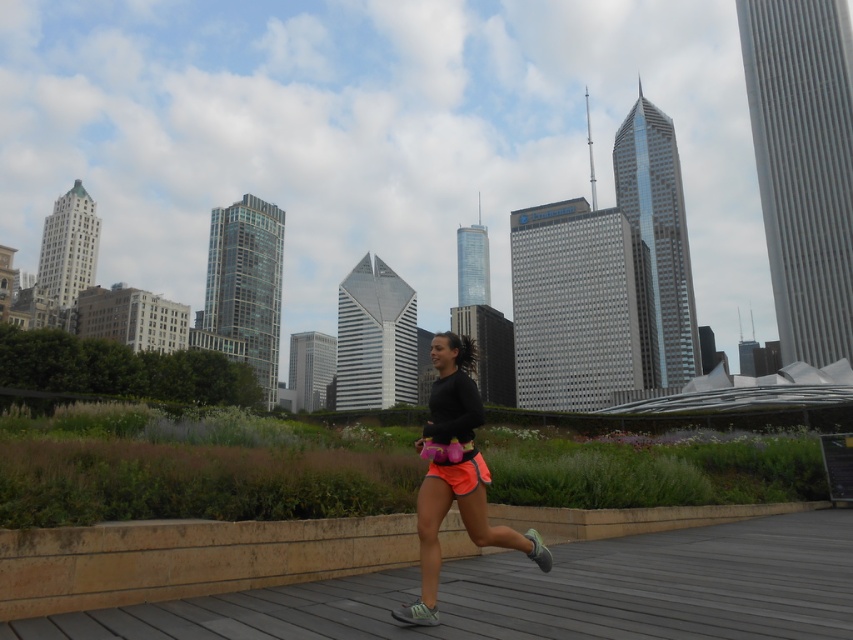
You are a photographer standing on the wooden deck at center and want to take a photo of the neon orange shorts at center. Which direction should you move to get the best shot?

The wooden deck at center is positioned on the right side of neon orange shorts at center, so you should move to the left to align yourself with the neon orange shorts at center for the best shot.

You are a photographer trying to capture the runner in the city scene. You notice the wooden deck at center and the neon orange shorts at center. Which object is positioned lower in the image?

The wooden deck at center is located below neon orange shorts at center, so it is positioned lower in the image.